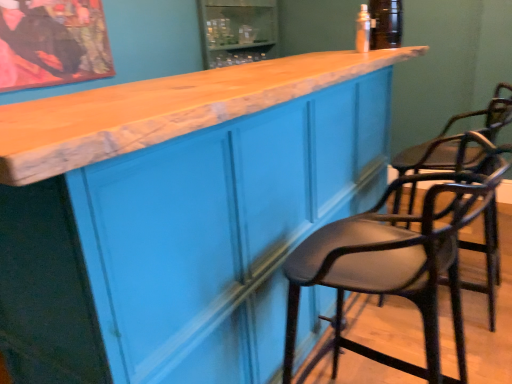
Question: Looking at the image, does black leather chair at right, positioned as the 2th chair in front-to-back order, seem bigger or smaller compared to matte black bar stool at right, the 2th chair when ordered from back to front?

Choices:
 (A) big
 (B) small

Answer: (A)

Question: In the image, is black leather chair at right, positioned as the 2th chair in front-to-back order, on the left side or the right side of matte black bar stool at right, arranged as the first chair when viewed from the front?

Choices:
 (A) left
 (B) right

Answer: (B)

Question: Which object is positioned closest to the black leather chair at right, which appears as the first chair when viewed from the back?

Choices:
 (A) matte blue cabinet at center
 (B) matte black bar stool at right, the 2th chair when ordered from back to front
 (C) clear plastic bottle at upper center

Answer: (B)

Question: Estimate the real-world distances between objects in this image. Which object is farther from the matte blue cabinet at center?

Choices:
 (A) matte black bar stool at right, arranged as the first chair when viewed from the front
 (B) black leather chair at right, which appears as the first chair when viewed from the back
 (C) clear plastic bottle at upper center

Answer: (B)